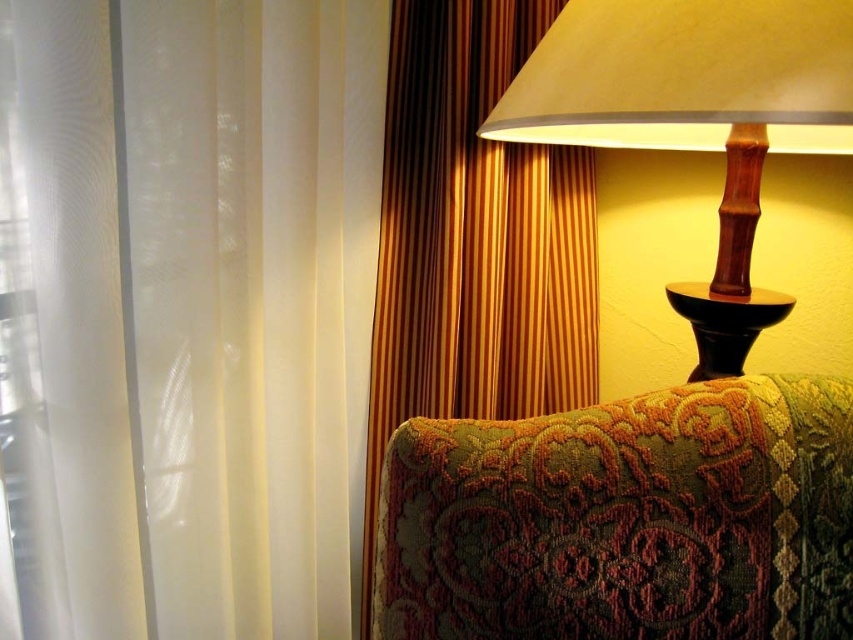
You are standing in the room and want to know the exact location of the white sheer curtain at left. What are its coordinates?

The white sheer curtain at left is located at coordinates point (189, 310).

You are a guest in this room and want to place a lamp on the black wood side table at right. However, you notice the gold striped curtain at upper right is blocking the path. Can you move the lamp to the side table without moving the curtain?

The gold striped curtain at upper right is to the left of the black wood side table at right, so the curtain is not blocking the path to the side table. You can move the lamp to the side table without any issue.

You are standing in the room and want to hang a picture frame on the wall. The frame is 1 meter wide. Is there enough space between the gold striped curtain at upper right and the sheer white curtain to the left to hang it?

The gold striped curtain at upper right is located at point (473, 241). However, without knowing the exact distance between the gold striped curtain at upper right and the sheer white curtain to the left, it is impossible to determine if there is enough space to hang the picture frame. Please measure the distance between them first.